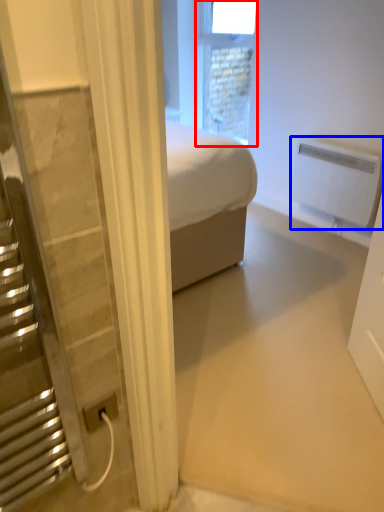
Question: Which of the following is the farthest to the observer, window (highlighted by a red box) or radiator (highlighted by a blue box)?

Choices:
 (A) window
 (B) radiator

Answer: (A)